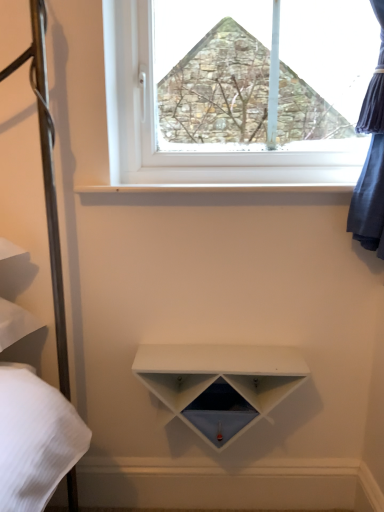
Question: Is white matte shelf at center wider or thinner than white plastic window at upper center?

Choices:
 (A) wide
 (B) thin

Answer: (A)

Question: In the image, is white matte shelf at center on the left side or the right side of white plastic window at upper center?

Choices:
 (A) left
 (B) right

Answer: (A)

Question: Estimate the real-world distances between objects in this image. Which object is closer to the white matte shelf at center?

Choices:
 (A) white plastic window at upper center
 (B) white smooth shelf at upper center

Answer: (B)

Question: Based on their relative distances, which object is farther from the white smooth shelf at upper center?

Choices:
 (A) white plastic window at upper center
 (B) white matte shelf at center

Answer: (B)